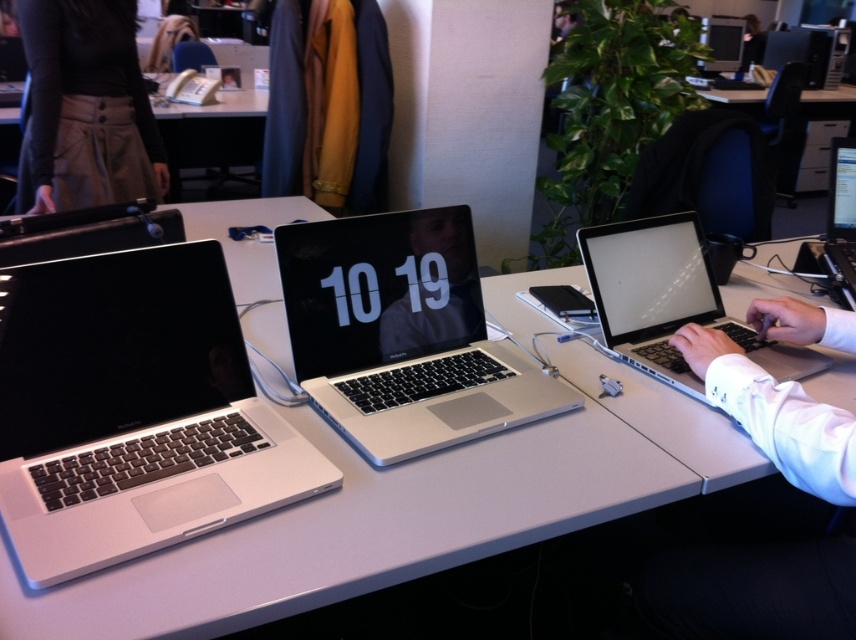
Based on the photo, you are organizing a meeting in the office and need to place a name tag on the silver metallic table at center. However, there is a khaki cotton skirt at upper left in the way. Can you place the name tag on the table without moving the skirt?

The silver metallic table at center is located below the khaki cotton skirt at upper left, so you can place the name tag on the silver metallic table at center without moving the khaki cotton skirt at upper left because it is positioned above the table.

You are organizing a tech fair and need to stack the silver metallic laptop at left and the satin silver laptop at right vertically. Which one should be placed at the bottom to ensure stability?

The satin silver laptop at right should be placed at the bottom because it is thicker than the silver metallic laptop at left, providing a more stable base for the stack.

In the scene shown: You are a delivery person who needs to place a small package on the desk without disturbing the laptops. The package requires 12 inches of space. Can you place it between the silver metallic table at center and the khaki cotton skirt at upper left?

The silver metallic table at center is 27.05 inches away from the khaki cotton skirt at upper left. Since the required space is 12 inches, the distance between them is sufficient to place the package without disturbing the laptops.